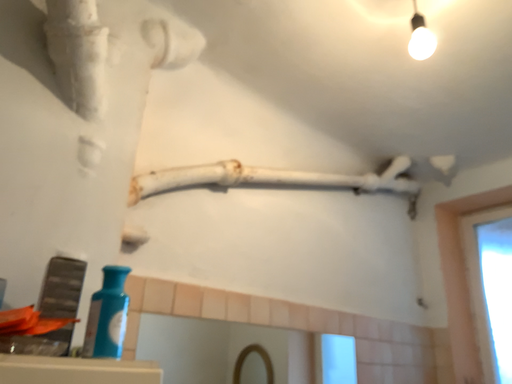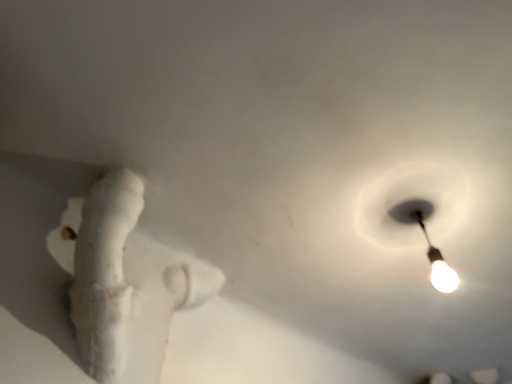
Question: Which way did the camera rotate in the video?

Choices:
 (A) rotated downward
 (B) rotated upward

Answer: (B)